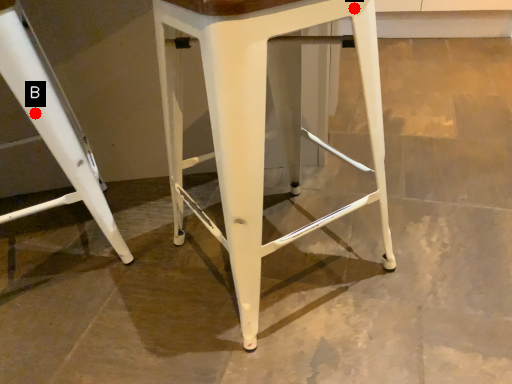
Question: Two points are circled on the image, labeled by A and B beside each circle. Which of the following is the farthest from the observer?

Choices:
 (A) A is further
 (B) B is further

Answer: (B)